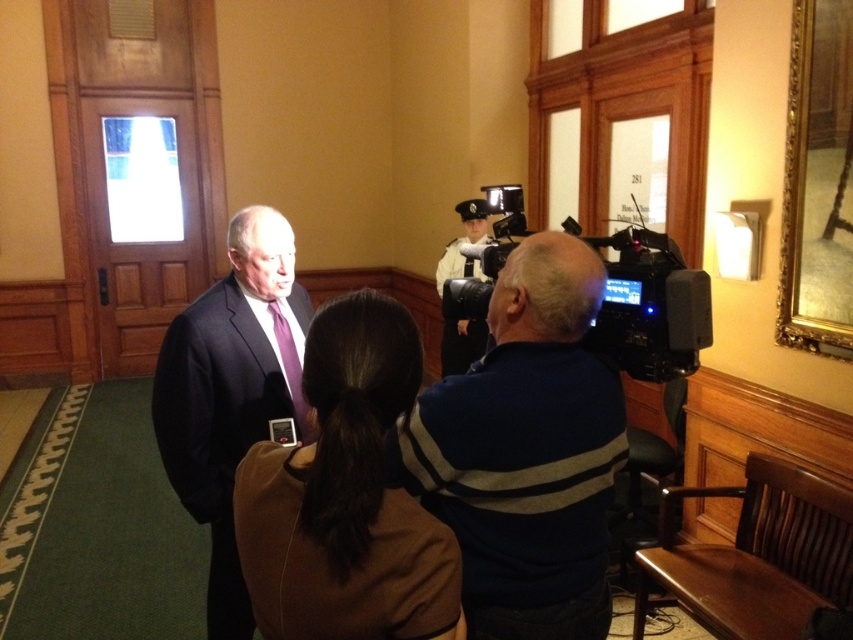
Question: Which object is the farthest from the white uniform at center?

Choices:
 (A) striped sweater at center
 (B) matte black suit at center

Answer: (A)

Question: Which object appears closest to the camera in this image?

Choices:
 (A) black plastic video camera at right
 (B) matte black suit at center

Answer: (A)

Question: Does striped sweater at center appear on the right side of black plastic video camera at right?

Choices:
 (A) no
 (B) yes

Answer: (A)

Question: Is matte black suit at center closer to the viewer compared to black plastic video camera at right?

Choices:
 (A) no
 (B) yes

Answer: (A)

Question: Can you confirm if striped sweater at center is smaller than white uniform at center?

Choices:
 (A) yes
 (B) no

Answer: (A)

Question: Among these points, which one is nearest to the camera?

Choices:
 (A) (474, 230)
 (B) (171, 349)

Answer: (B)